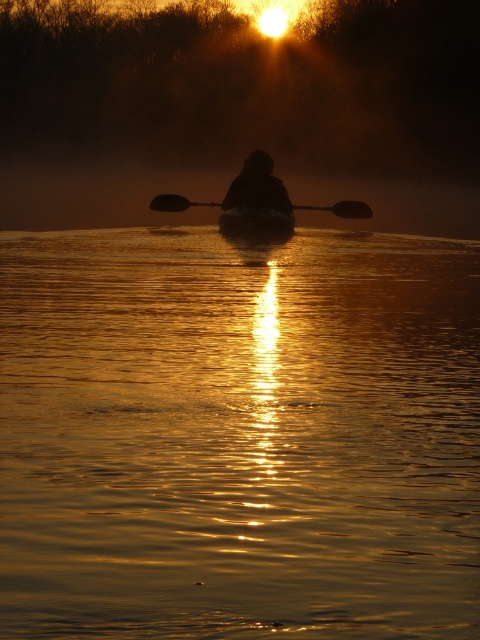
Where is the silhouette figure at center located in the image?

The silhouette figure at center is located at point coordinates of (257, 186).

You are a photographer trying to capture the reflection of the smooth dark wood canoe at center and the black rubber paddle at center in the water. Which object will have its reflection closer to the photographer?

The smooth dark wood canoe at center is in front of the black rubber paddle at center, so its reflection will be closer to the photographer.